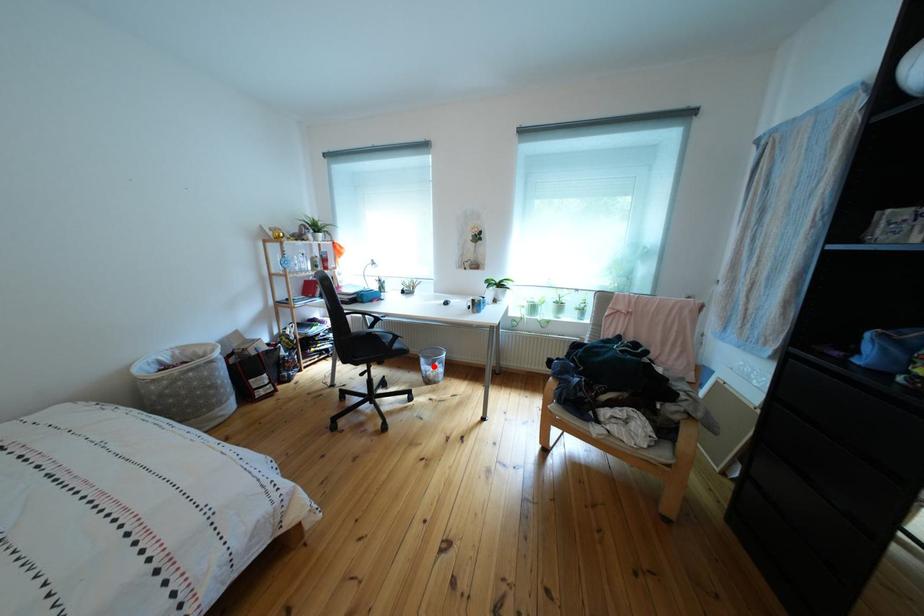
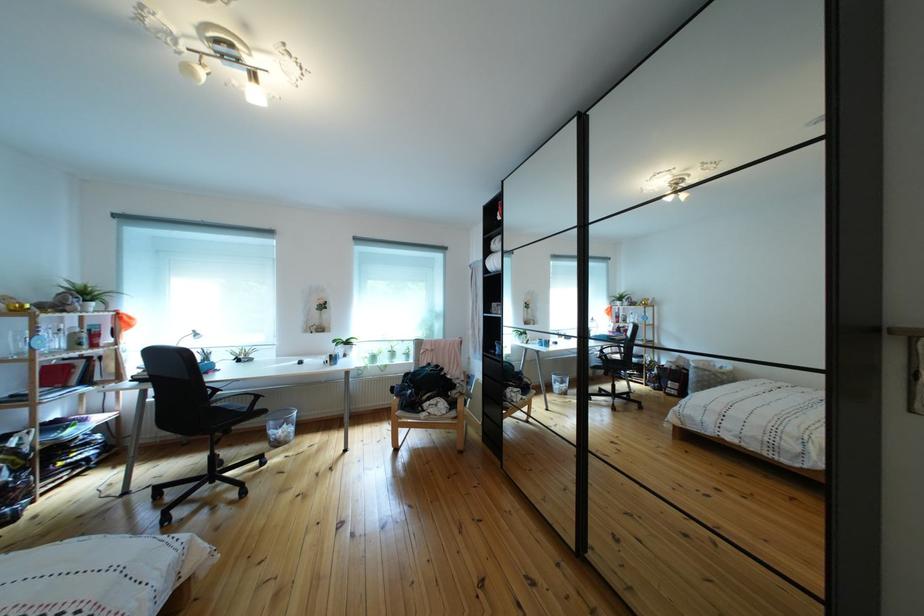
Question: I am providing you with two images of the same scene from different viewpoints. Given a red point in image1, look at the same physical point in image2. Is it:

Choices:
 (A) Closer to the viewpoint
 (B) Farther from the viewpoint

Answer: (A)